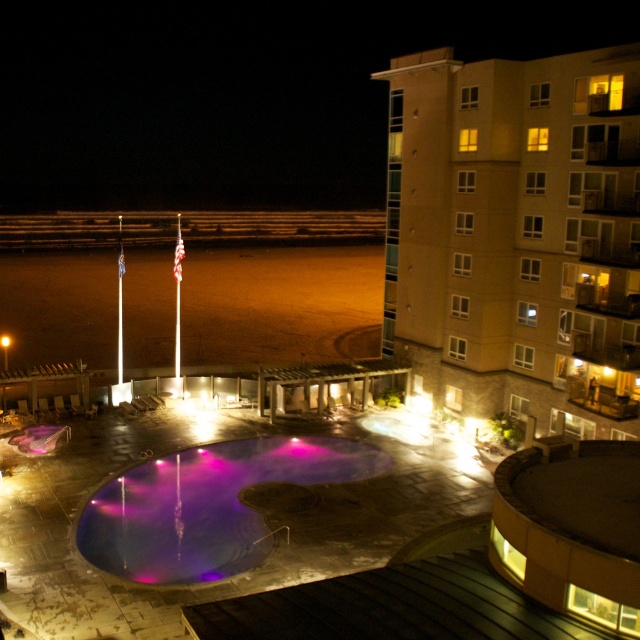
Measure the distance between beige concrete building at upper right and camera.

beige concrete building at upper right and camera are 32.95 meters apart from each other.

Between point (388, 305) and point (109, 556), which one is positioned behind?

Point (388, 305)

Describe the element at coordinates (516, 234) in the screenshot. This screenshot has height=640, width=640. I see `beige concrete building at upper right` at that location.

Where is `beige concrete building at upper right`? The image size is (640, 640). beige concrete building at upper right is located at coordinates (516, 234).